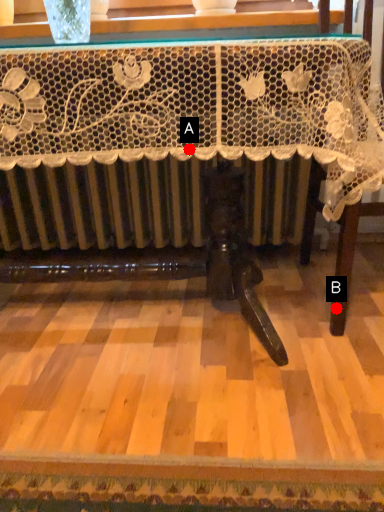
Question: Two points are circled on the image, labeled by A and B beside each circle. Which point is farther to the camera?

Choices:
 (A) A is further
 (B) B is further

Answer: (B)